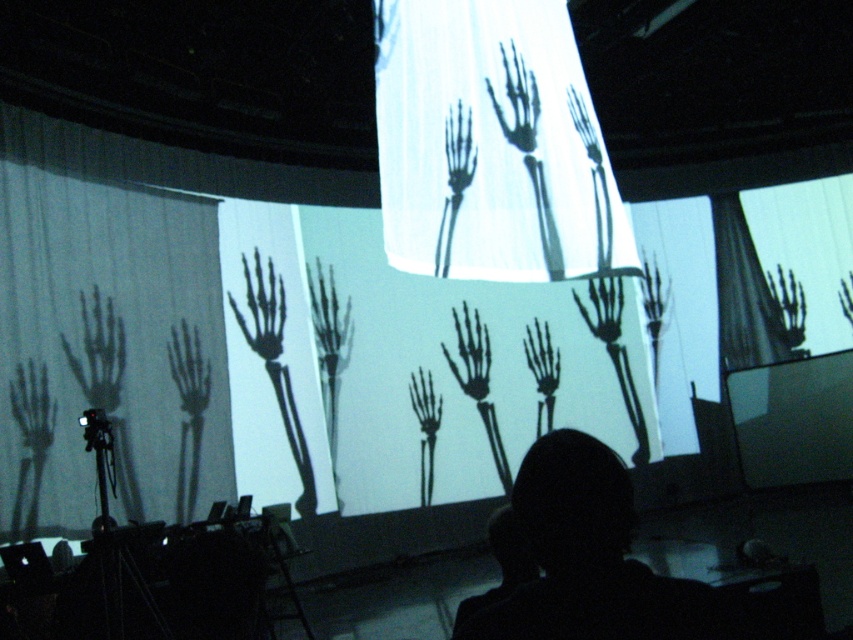
Question: Which of the following is the closest to the observer?

Choices:
 (A) transparent plastic skeleton hand at upper center
 (B) black hair at lower center
 (C) transparent bone-like hand at center
 (D) black matte tripod at lower left

Answer: (B)

Question: Does black matte tripod at lower left appear over transparent bone-like hand at center?

Choices:
 (A) no
 (B) yes

Answer: (A)

Question: Is black hair at lower center thinner than black matte tripod at lower left?

Choices:
 (A) yes
 (B) no

Answer: (A)

Question: Where is black matte tripod at lower left located in relation to transparent plastic skeleton hand at upper center in the image?

Choices:
 (A) above
 (B) below

Answer: (B)

Question: Which of these objects is positioned closest to the black matte tripod at lower left?

Choices:
 (A) transparent bone-like hand at center
 (B) transparent plastic skeleton hand at upper center
 (C) black hair at lower center

Answer: (A)

Question: Which object is the closest to the black matte tripod at lower left?

Choices:
 (A) transparent plastic skeleton hand at upper center
 (B) black hair at lower center

Answer: (A)